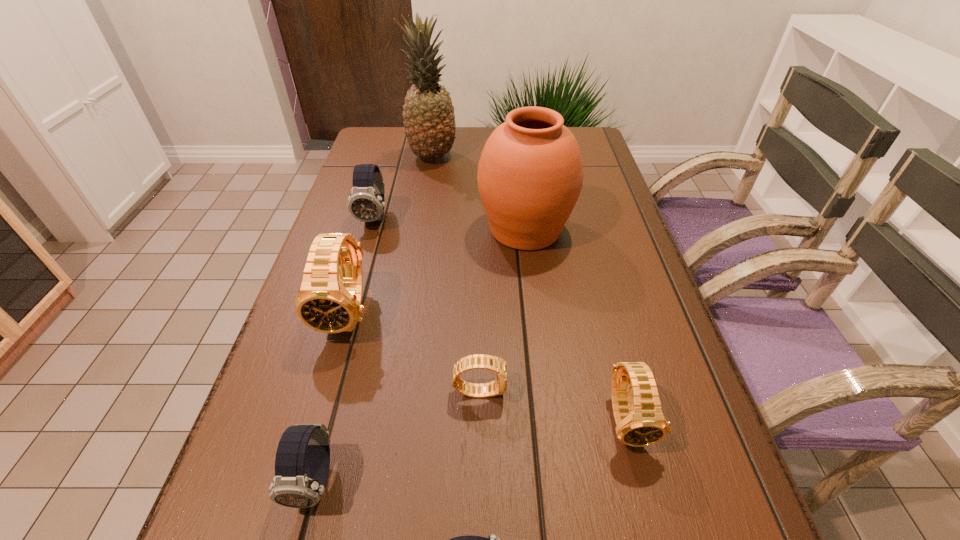
Point out which dark watch is positioned as the second nearest to the farthest object. Please provide its 2D coordinates. Your answer should be formatted as a tuple, i.e. [(x, y)], where the tuple contains the x and y coordinates of a point satisfying the conditions above.

[(302, 462)]

What are the coordinates of `dark watch that is the second nearest to the biggest dark watch` in the screenshot? It's located at (492, 539).

This screenshot has height=540, width=960. I want to click on free space that satisfies the following two spatial constraints: 1. on the face of the second black watch from right to left; 2. on the face of the second farthest dark watch, so click(479, 481).